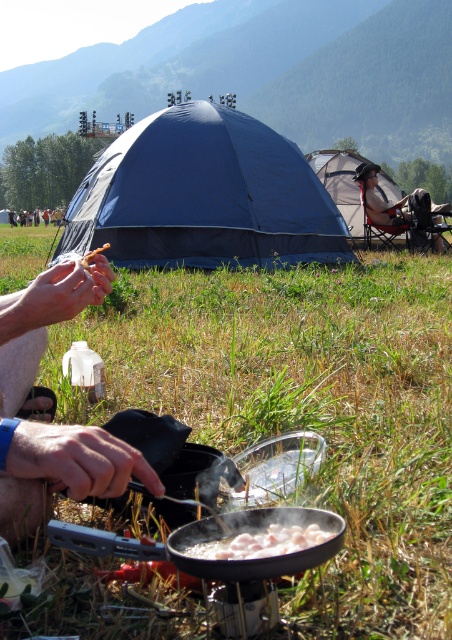
Question: Which of the following is the closest to the observer?

Choices:
 (A) white glossy meat at center
 (B) blue fabric tent at center

Answer: (A)

Question: Does blue fabric tent at center appear on the right side of gray fabric tent at center?

Choices:
 (A) yes
 (B) no

Answer: (B)

Question: Can you confirm if blue fabric tent at center is thinner than gray fabric tent at center?

Choices:
 (A) yes
 (B) no

Answer: (B)

Question: Which point is closer to the camera?

Choices:
 (A) gray fabric tent at center
 (B) white glossy meat at center

Answer: (B)

Question: Based on their relative distances, which object is nearer to the gray fabric tent at center?

Choices:
 (A) white glossy meat at center
 (B) blue fabric tent at center

Answer: (B)

Question: Is blue fabric tent at center to the right of gray fabric tent at center from the viewer's perspective?

Choices:
 (A) no
 (B) yes

Answer: (A)